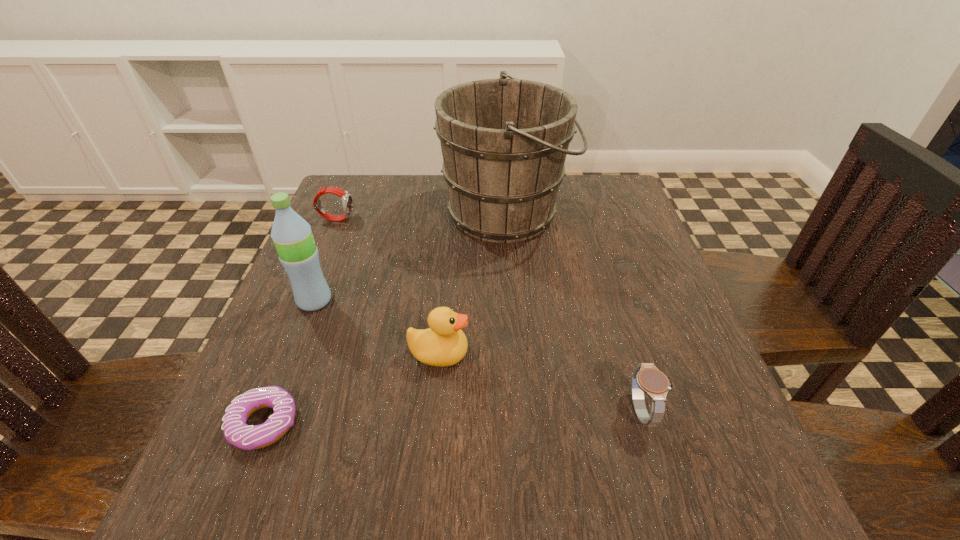
At what (x,y) coordinates should I click in order to perform the action: click on watch that is at the right edge. Please return your answer as a coordinate pair (x, y). The width and height of the screenshot is (960, 540). Looking at the image, I should click on (647, 378).

The height and width of the screenshot is (540, 960). What are the coordinates of `object positioned at the far left corner` in the screenshot? It's located at (347, 202).

Locate an element on the screen. The width and height of the screenshot is (960, 540). object at the far right corner is located at coordinates [504, 142].

The height and width of the screenshot is (540, 960). What are the coordinates of `free space at the near edge of the desktop` in the screenshot? It's located at pos(530,497).

Image resolution: width=960 pixels, height=540 pixels. Identify the location of free space at the left edge. pyautogui.click(x=276, y=376).

The width and height of the screenshot is (960, 540). What are the coordinates of `free space at the right edge of the desktop` in the screenshot? It's located at (664, 321).

The image size is (960, 540). Identify the location of vacant space at the far left corner of the desktop. (370, 196).

In the image, there is a desktop. What are the coordinates of `free space at the near left corner` in the screenshot? It's located at (290, 471).

Image resolution: width=960 pixels, height=540 pixels. I want to click on free location at the far right corner, so click(x=585, y=185).

In the image, there is a desktop. Where is `blank space at the near right corner`? blank space at the near right corner is located at coordinates (662, 504).